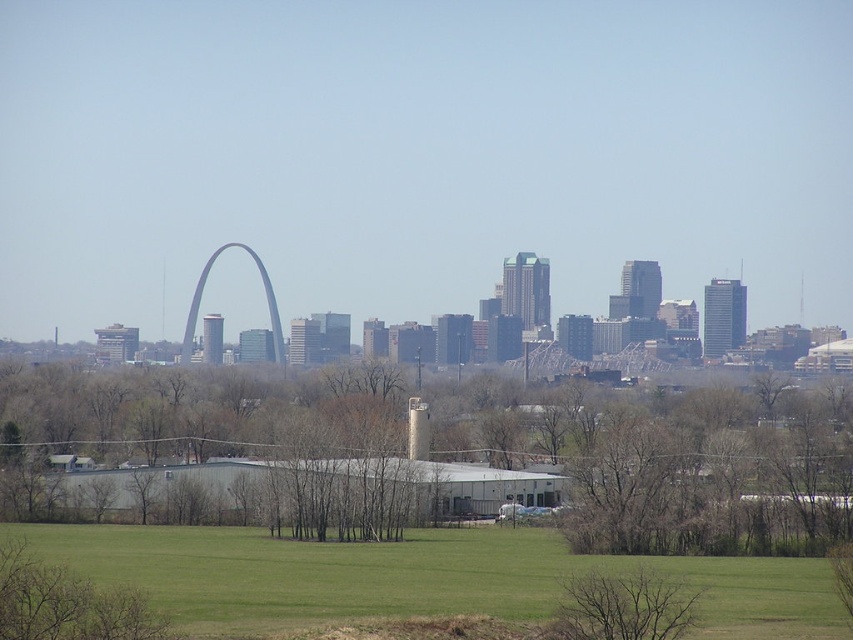
You are standing in the city park and see the green leafy tree at center and the green grass at lower center. Which object is positioned to the right of the other?

The green leafy tree at center is to the right of green grass at lower center.

You are a photographer planning to capture the iconic arch structure in the background while including both the green leafy tree at center and the green grass at lower center in your shot. Which object will occupy more space in your photo?

The green leafy tree at center will occupy more space in the photo because it is bigger than the green grass at lower center.

You are standing in a city park and see the green leafy tree at center and the matte gray arch at center. Which object is closer to you?

The green leafy tree at center is closer to you because it is positioned under the matte gray arch at center, indicating it is in front of the arch.